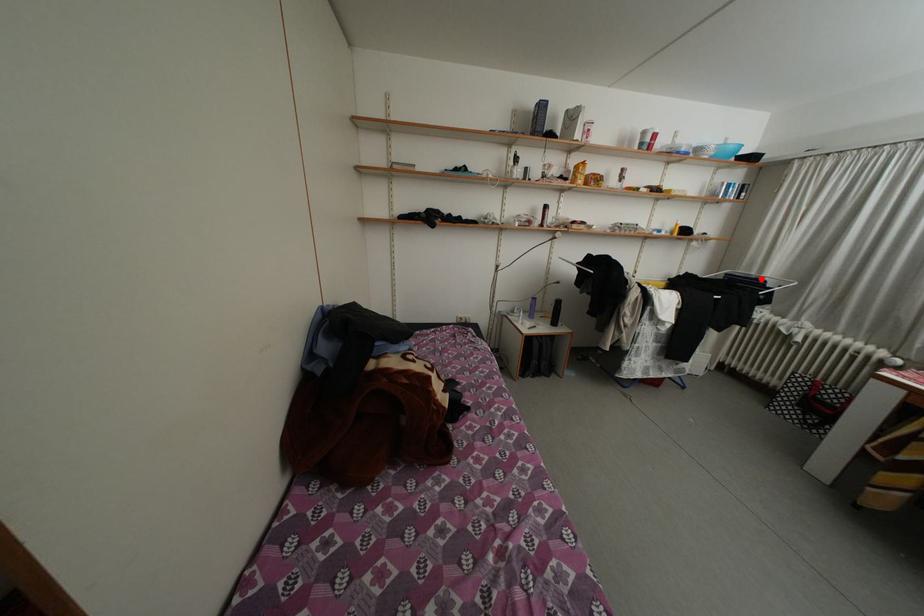
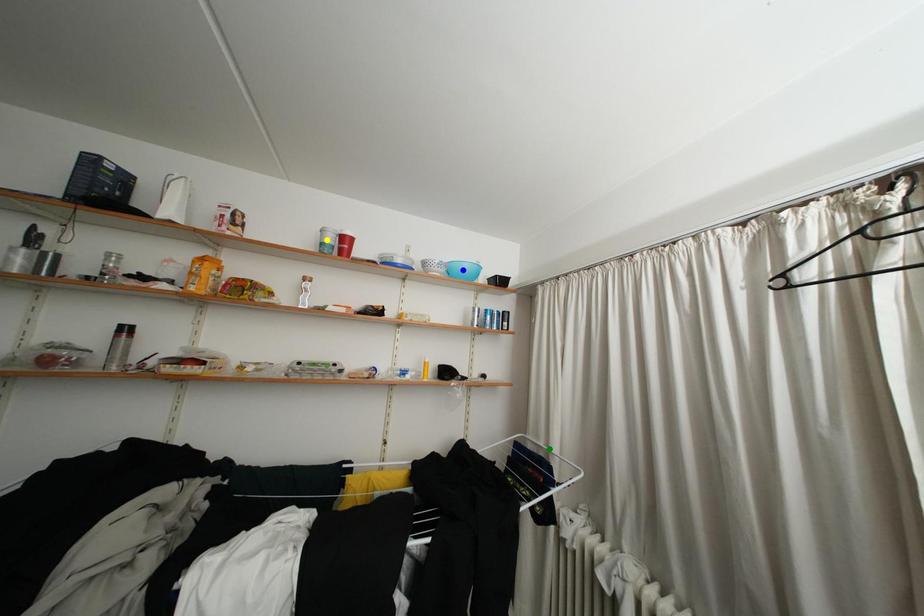
Question: I am providing you with two images of the same scene from different viewpoints. A red point is marked on the first image. You are given multiple points on the second image. In image 2, which mark is for the same physical point as the one in image 1?

Choices:
 (A) green point
 (B) blue point
 (C) yellow point

Answer: (A)